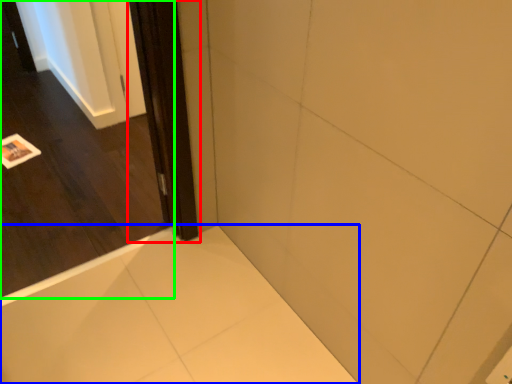
Question: Which is farther away from screen door (highlighted by a red box)? bath (highlighted by a blue box) or door (highlighted by a green box)?

Choices:
 (A) bath
 (B) door

Answer: (B)